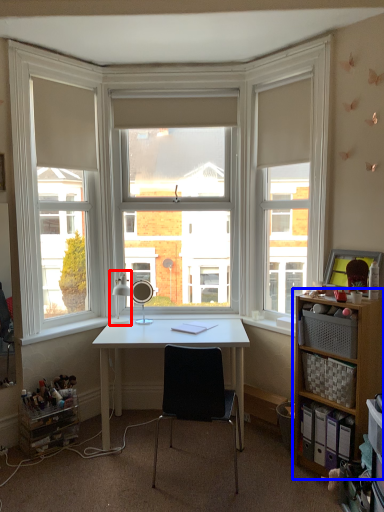
Question: Which of the following is the farthest to the observer, table lamp (highlighted by a red box) or shelf (highlighted by a blue box)?

Choices:
 (A) table lamp
 (B) shelf

Answer: (A)